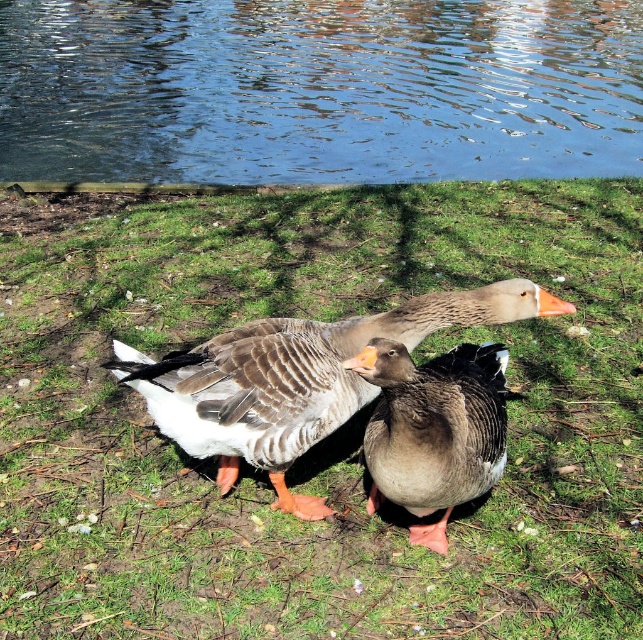
Question: Among these points, which one is farthest from the camera?

Choices:
 (A) pyautogui.click(x=251, y=339)
 (B) pyautogui.click(x=415, y=445)
 (C) pyautogui.click(x=285, y=10)

Answer: (C)

Question: Which point is farther to the camera?

Choices:
 (A) blue reflective water at upper center
 (B) gray feathered duck at center
 (C) green grassy at center

Answer: (A)

Question: Observing the image, what is the correct spatial positioning of green grassy at center in reference to gray feathered duck at center?

Choices:
 (A) right
 (B) left

Answer: (B)

Question: Is blue reflective water at upper center thinner than gray matte duck at center?

Choices:
 (A) no
 (B) yes

Answer: (A)

Question: Can you confirm if green grassy at center is positioned to the left of gray feathered duck at center?

Choices:
 (A) yes
 (B) no

Answer: (A)

Question: Which point is farther from the camera taking this photo?

Choices:
 (A) (28, 140)
 (B) (341, 528)
 (C) (442, 419)

Answer: (A)